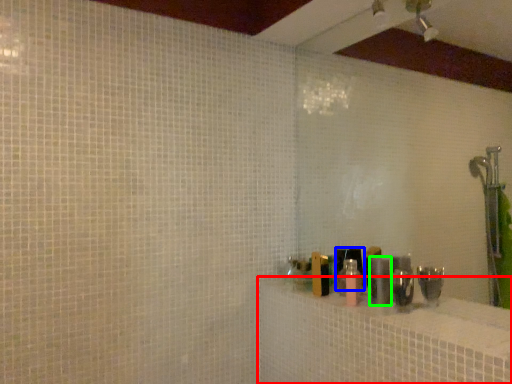
Question: Which object is positioned closest to bath (highlighted by a red box)? Select from toiletry (highlighted by a blue box) and toiletry (highlighted by a green box).

Choices:
 (A) toiletry
 (B) toiletry

Answer: (B)